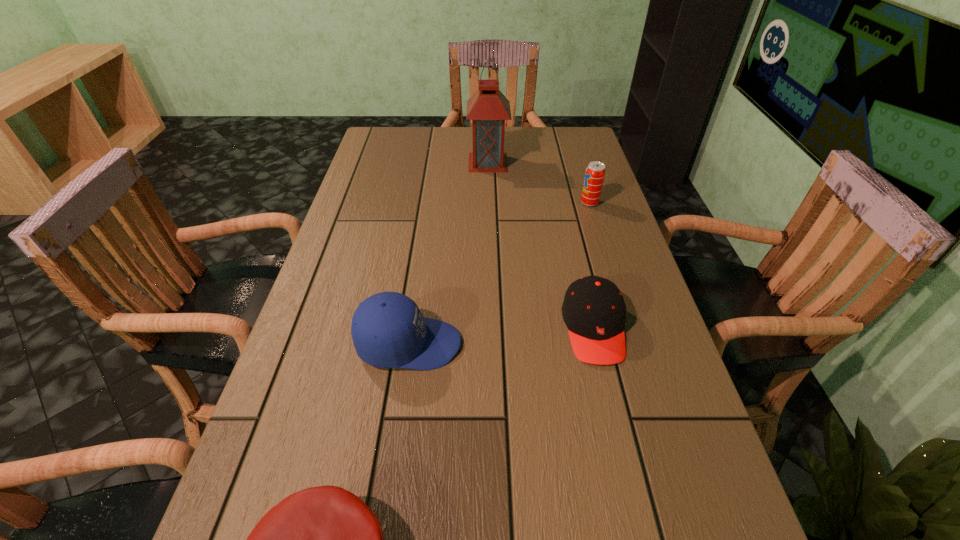
The width and height of the screenshot is (960, 540). What are the coordinates of `object that is at the left edge` in the screenshot? It's located at (388, 330).

Identify the location of soda can positioned at the right edge. (595, 172).

This screenshot has height=540, width=960. What are the coordinates of `cap present at the right edge` in the screenshot? It's located at (594, 311).

Find the location of `vacant space at the left edge`. vacant space at the left edge is located at coordinates (263, 492).

The width and height of the screenshot is (960, 540). I want to click on vacant space at the right edge, so click(654, 457).

This screenshot has width=960, height=540. Find the location of `vacant space at the far left corner of the desktop`. vacant space at the far left corner of the desktop is located at coordinates (367, 155).

You are a GUI agent. You are given a task and a screenshot of the screen. Output one action in this format:
    pyautogui.click(x=<x>, y=<y>)
    Task: Click on the free point between the fourth nearest object and the lantern
    
    Given the screenshot: What is the action you would take?
    pyautogui.click(x=539, y=183)

Identify the location of free spot between the second farthest object and the tallest object. [x=539, y=183].

Where is `vacant point located between the second farthest object and the lantern`? vacant point located between the second farthest object and the lantern is located at coordinates (539, 183).

Find the location of a particular element. The width and height of the screenshot is (960, 540). vacant area that lies between the rightmost cap and the farthest object is located at coordinates (540, 245).